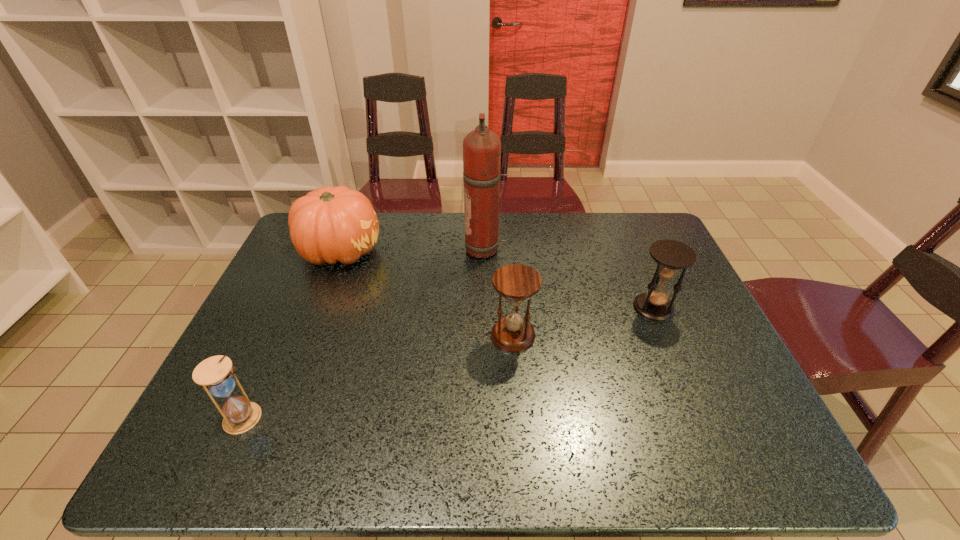
Locate an element on the screen. This screenshot has height=540, width=960. blank region between the pumpkin and the leftmost hourglass is located at coordinates (293, 334).

I want to click on vacant region between the pumpkin and the nearest hourglass, so click(293, 334).

At what (x,y) coordinates should I click in order to perform the action: click on vacant region between the rightmost hourglass and the leftmost hourglass. Please return your answer as a coordinate pair (x, y). The width and height of the screenshot is (960, 540). Looking at the image, I should click on (449, 363).

Where is `vacant region between the tallest object and the rightmost object`? This screenshot has width=960, height=540. vacant region between the tallest object and the rightmost object is located at coordinates pyautogui.click(x=569, y=279).

Find the location of a particular element. empty space between the rightmost hourglass and the leftmost hourglass is located at coordinates (449, 363).

The height and width of the screenshot is (540, 960). Identify the location of vacant area that lies between the nearest object and the pumpkin. (293, 334).

Locate an element on the screen. object that can be found as the third closest to the pumpkin is located at coordinates (215, 374).

In order to click on object that ranks as the second closest to the rightmost object in this screenshot , I will do `click(481, 147)`.

At what (x,y) coordinates should I click in order to perform the action: click on the second closest hourglass relative to the rightmost hourglass. Please return your answer as a coordinate pair (x, y). The width and height of the screenshot is (960, 540). Looking at the image, I should click on (215, 374).

Where is `hourglass that can be found as the second closest to the nearest hourglass`? The height and width of the screenshot is (540, 960). hourglass that can be found as the second closest to the nearest hourglass is located at coordinates (671, 256).